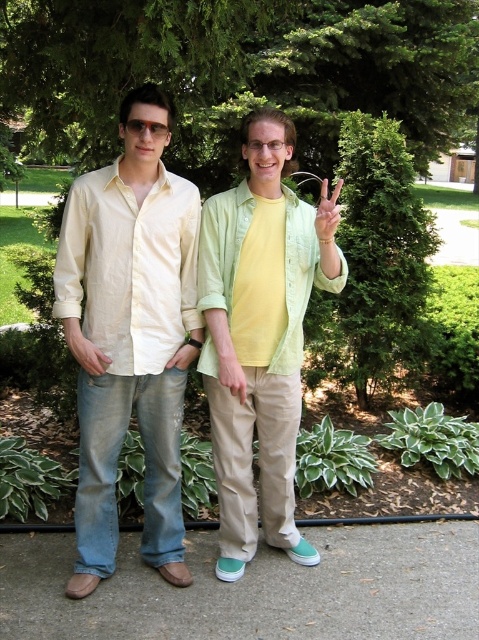
You are standing at the edge of the garden pathway. You need to place a 3.0 meter long wooden bench along the gray concrete pavement at lower center. Is there enough space for the bench?

The gray concrete pavement at lower center is only 2.80 meters away from the viewer, which is shorter than the 3.0 meter bench. Therefore, the bench would not fit along the gray concrete pavement at lower center.

You are a gardener who needs to place a new plant pot in the garden. You see the gray concrete pavement at lower center and the green matte hand at center. Which object is closer to you, the gardener?

The gray concrete pavement at lower center is closer to you because the green matte hand at center is behind it.